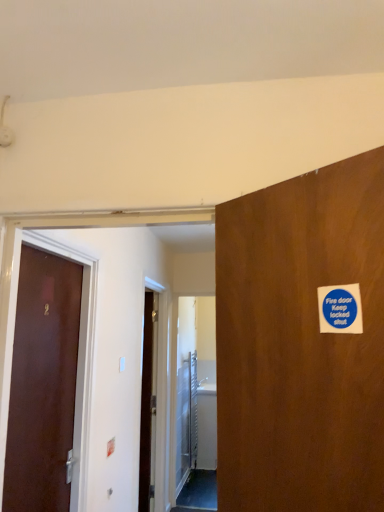
Locate an element on the screen. This screenshot has width=384, height=512. brown matte door at left is located at coordinates (42, 383).

Where is `metallic silver elevator door at center`? Image resolution: width=384 pixels, height=512 pixels. metallic silver elevator door at center is located at coordinates (186, 420).

Locate an element on the screen. blue paper sticker at upper right is located at coordinates (340, 309).

Locate an element on the screen. The height and width of the screenshot is (512, 384). brown matte door at left is located at coordinates 42,383.

Is blue paper sticker at upper right wider than brown matte door at left?

No.

Is blue paper sticker at upper right positioned with its back to brown matte door at left?

No, blue paper sticker at upper right is not facing away from brown matte door at left.

Which is more to the right, blue paper sticker at upper right or brown matte door at left?

Positioned to the right is blue paper sticker at upper right.

Is blue paper sticker at upper right completely or partially outside of brown matte door at left?

Yes, blue paper sticker at upper right is outside of brown matte door at left.

Is brown matte door at left closer to the viewer compared to blue paper sticker at upper right?

No, it is not.

Based on the photo, considering the sizes of objects brown matte door at left and blue paper sticker at upper right in the image provided, who is wider, brown matte door at left or blue paper sticker at upper right?

brown matte door at left.

How many degrees apart are the facing directions of brown matte door at left and blue paper sticker at upper right?

Result: There is a 134-degree angle between the facing directions of brown matte door at left and blue paper sticker at upper right.

Can you confirm if brown matte door at left is shorter than blue paper sticker at upper right?

In fact, brown matte door at left may be taller than blue paper sticker at upper right.

From the image's perspective, would you say blue paper sticker at upper right is shown under metallic silver elevator door at center?

No, from the image's perspective, blue paper sticker at upper right is not beneath metallic silver elevator door at center.

Find the location of a particular element. elevator door located below the blue paper sticker at upper right (from the image's perspective) is located at coordinates (186, 420).

In terms of height, does blue paper sticker at upper right look taller or shorter compared to metallic silver elevator door at center?

blue paper sticker at upper right is shorter than metallic silver elevator door at center.

Are blue paper sticker at upper right and metallic silver elevator door at center beside each other?

No, blue paper sticker at upper right is not with metallic silver elevator door at center.

Is the depth of metallic silver elevator door at center greater than that of brown matte door at left?

Yes, metallic silver elevator door at center is behind brown matte door at left.

Are metallic silver elevator door at center and brown matte door at left located far from each other?

Yes, metallic silver elevator door at center and brown matte door at left are quite far apart.

Which is in front, point (194, 422) or point (20, 351)?

The point (20, 351) is more forward.

Can you confirm if metallic silver elevator door at center is bigger than brown matte door at left?

Correct, metallic silver elevator door at center is larger in size than brown matte door at left.

Considering the sizes of objects brown matte door at left and metallic silver elevator door at center in the image provided, who is wider, brown matte door at left or metallic silver elevator door at center?

metallic silver elevator door at center is wider.

From the image's perspective, is brown matte door at left positioned above or below metallic silver elevator door at center?

brown matte door at left is situated higher than metallic silver elevator door at center in the image.

Is point (72, 381) positioned before point (185, 367)?

Yes, it is in front of point (185, 367).

Which object is positioned more to the left, brown matte door at left or metallic silver elevator door at center?

From the viewer's perspective, brown matte door at left appears more on the left side.

Considering the relative positions of metallic silver elevator door at center and blue paper sticker at upper right in the image provided, is metallic silver elevator door at center behind blue paper sticker at upper right?

That is True.

What's the angular difference between metallic silver elevator door at center and blue paper sticker at upper right's facing directions?

There is a 133-degree angle between the facing directions of metallic silver elevator door at center and blue paper sticker at upper right.

Between metallic silver elevator door at center and blue paper sticker at upper right, which one has larger width?

With larger width is metallic silver elevator door at center.

Locate an element on the screen. Image resolution: width=384 pixels, height=512 pixels. sticker on the right of brown matte door at left is located at coordinates (340, 309).

Identify the location of door beneath the blue paper sticker at upper right (from a real-world perspective). (42, 383).

Which object lies nearer to the anchor point blue paper sticker at upper right, metallic silver elevator door at center or brown matte door at left?

brown matte door at left is closer to blue paper sticker at upper right.

Looking at the image, which one is located closer to blue paper sticker at upper right, brown matte door at left or metallic silver elevator door at center?

Among the two, brown matte door at left is located nearer to blue paper sticker at upper right.

Looking at the image, which one is located closer to brown matte door at left, metallic silver elevator door at center or blue paper sticker at upper right?

Among the two, blue paper sticker at upper right is located nearer to brown matte door at left.

Based on their spatial positions, is brown matte door at left or blue paper sticker at upper right closer to metallic silver elevator door at center?

brown matte door at left lies closer to metallic silver elevator door at center than the other object.

Looking at the image, which one is located further to metallic silver elevator door at center, blue paper sticker at upper right or brown matte door at left?

Based on the image, blue paper sticker at upper right appears to be further to metallic silver elevator door at center.

Which object lies nearer to the anchor point brown matte door at left, blue paper sticker at upper right or metallic silver elevator door at center?

The object closer to brown matte door at left is blue paper sticker at upper right.

Identify the location of door between blue paper sticker at upper right and metallic silver elevator door at center along the z-axis. This screenshot has height=512, width=384. (42, 383).